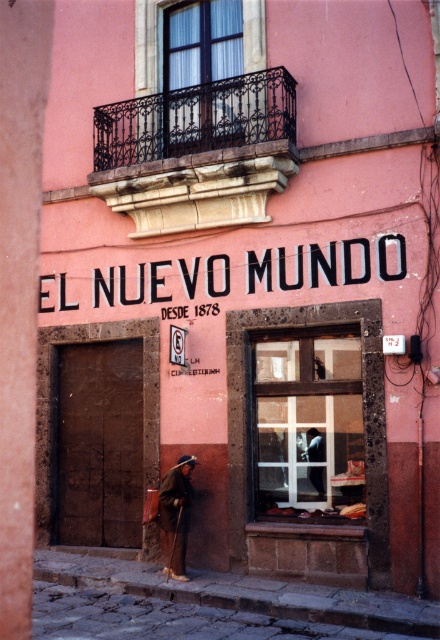
Can you confirm if brown woolen robe at lower center is shorter than white cotton robe at center?

In fact, brown woolen robe at lower center may be taller than white cotton robe at center.

What do you see at coordinates (176, 513) in the screenshot? I see `brown woolen robe at lower center` at bounding box center [176, 513].

The height and width of the screenshot is (640, 440). Identify the location of brown woolen robe at lower center. (176, 513).